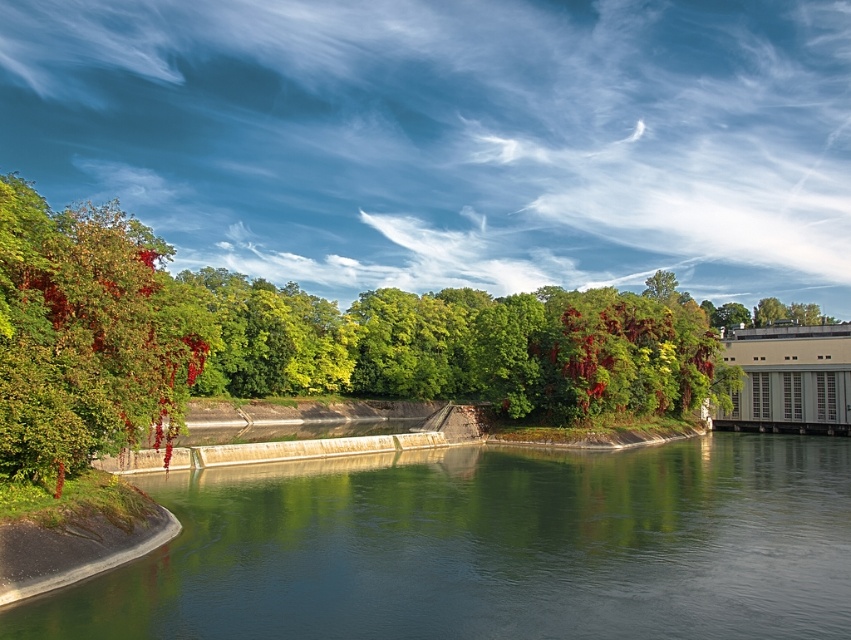
You are standing at the center of the image and want to walk towards the green concrete river at lower left. In which general direction should you move?

You should move towards the lower left direction to reach the green concrete river at lower left as it is located at point [489,547].

You are a bird looking to land on the green concrete river at lower left. Are the shiny red berries at left above or below you when you hover there?

The green concrete river at lower left is positioned under shiny red berries at left, so the berries are above you when you hover there.

You are a hiker who wants to cross the green concrete river at lower left to reach the shiny red berries at left. The river is flowing gently. Do you think you can safely cross the river to get to the berries?

The green concrete river at lower left and shiny red berries at left are 66.58 feet apart. This distance indicates the river is quite wide, so crossing it might be challenging and unsafe without proper equipment or a bridge. It is advisable to find another path or wait for assistance.